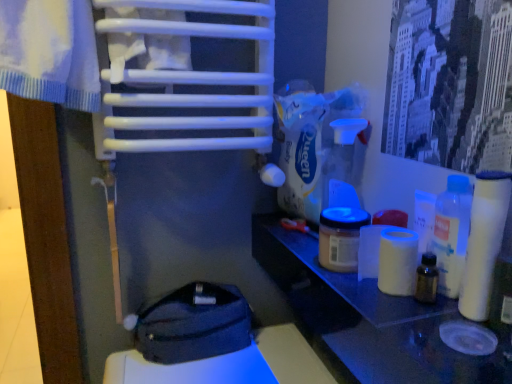
This screenshot has width=512, height=384. What do you see at coordinates (452, 233) in the screenshot? I see `translucent plastic bottle at right` at bounding box center [452, 233].

In the scene shown: Measure the distance between dark gray fabric pouch at lower center and camera.

The distance of dark gray fabric pouch at lower center from camera is 37.83 inches.

This screenshot has height=384, width=512. What do you see at coordinates (194, 324) in the screenshot?
I see `dark gray fabric pouch at lower center` at bounding box center [194, 324].

I want to click on white matte toilet paper at right, which appears as the 1th toilet paper when viewed from the left, so click(x=397, y=261).

Image resolution: width=512 pixels, height=384 pixels. Describe the element at coordinates (341, 237) in the screenshot. I see `matte plastic jar at center` at that location.

What do you see at coordinates (366, 319) in the screenshot?
I see `white glossy table at right` at bounding box center [366, 319].

I want to click on white matte toilet paper at right, which ranks as the 1th toilet paper in right-to-left order, so click(x=484, y=242).

Looking at this image, can you tell me how much dark gray fabric pouch at lower center and white matte toilet paper at right, marked as the second toilet paper in a front-to-back arrangement, differ in facing direction?

A: The angular difference between dark gray fabric pouch at lower center and white matte toilet paper at right, marked as the second toilet paper in a front-to-back arrangement, is 89.8 degrees.

Could white matte toilet paper at right, marked as the second toilet paper in a front-to-back arrangement, be considered to be inside dark gray fabric pouch at lower center?

No, white matte toilet paper at right, marked as the second toilet paper in a front-to-back arrangement, is not surrounded by dark gray fabric pouch at lower center.

Could you tell me if dark gray fabric pouch at lower center is facing white matte toilet paper at right, which appears as the 1th toilet paper when viewed from the left?

No.

Where is `pouch behind the white matte toilet paper at right, which appears as the 1th toilet paper when viewed from the left`? This screenshot has width=512, height=384. pouch behind the white matte toilet paper at right, which appears as the 1th toilet paper when viewed from the left is located at coordinates (194, 324).

Is white glossy table at right aimed at white matte toilet paper at right, which appears as the 1th toilet paper when viewed from the left?

No, white glossy table at right is not oriented towards white matte toilet paper at right, which appears as the 1th toilet paper when viewed from the left.

Is white glossy table at right beside white matte toilet paper at right, the first toilet paper viewed from the back?

No.

Based on the photo, does white glossy table at right have a smaller size compared to white matte toilet paper at right, which appears as the 1th toilet paper when viewed from the left?

No.

Is white matte toilet paper at right, which ranks as the 2th toilet paper in left-to-right order, in contact with dark gray fabric pouch at lower center?

white matte toilet paper at right, which ranks as the 2th toilet paper in left-to-right order, is not next to dark gray fabric pouch at lower center, and they're not touching.

Is white matte toilet paper at right, which ranks as the 1th toilet paper in right-to-left order, facing away from dark gray fabric pouch at lower center?

That's not correct — white matte toilet paper at right, which ranks as the 1th toilet paper in right-to-left order, is not looking away from dark gray fabric pouch at lower center.

From the image's perspective, who appears lower, dark gray fabric pouch at lower center or translucent plastic bottle at right?

dark gray fabric pouch at lower center is shown below in the image.

Considering the relative sizes of dark gray fabric pouch at lower center and translucent plastic bottle at right in the image provided, is dark gray fabric pouch at lower center thinner than translucent plastic bottle at right?

Incorrect, the width of dark gray fabric pouch at lower center is not less than that of translucent plastic bottle at right.

Is point (181, 303) positioned behind point (463, 227)?

Yes, point (181, 303) is farther from viewer.

From the image's perspective, is white matte toilet paper at right, which ranks as the 1th toilet paper in right-to-left order, positioned above or below white glossy table at right?

white matte toilet paper at right, which ranks as the 1th toilet paper in right-to-left order, is situated higher than white glossy table at right in the image.

Does white matte toilet paper at right, marked as the first toilet paper in a front-to-back arrangement, touch white glossy table at right?

There is a gap between white matte toilet paper at right, marked as the first toilet paper in a front-to-back arrangement, and white glossy table at right.

Can you tell me how much white matte toilet paper at right, which ranks as the 2th toilet paper in left-to-right order, and white glossy table at right differ in facing direction?

The facing directions of white matte toilet paper at right, which ranks as the 2th toilet paper in left-to-right order, and white glossy table at right are 17.5 degrees apart.

Between point (505, 180) and point (323, 304), which one is positioned behind?

The point (323, 304) is more distant.

Is translucent plastic bottle at right completely or partially inside white matte toilet paper at right, which ranks as the 1th toilet paper in right-to-left order?

No, white matte toilet paper at right, which ranks as the 1th toilet paper in right-to-left order, does not contain translucent plastic bottle at right.

There is a translucent plastic bottle at right. At what (x,y) coordinates should I click in order to perform the action: click on toilet paper above it (from a real-world perspective). Please return your answer as a coordinate pair (x, y). Image resolution: width=512 pixels, height=384 pixels. Looking at the image, I should click on (484, 242).

In the image, is white matte toilet paper at right, marked as the first toilet paper in a front-to-back arrangement, on the left side or the right side of translucent plastic bottle at right?

white matte toilet paper at right, marked as the first toilet paper in a front-to-back arrangement, is to the right of translucent plastic bottle at right.

Considering their positions, is white matte toilet paper at right, which ranks as the 2th toilet paper in left-to-right order, located in front of or behind translucent plastic bottle at right?

Clearly, white matte toilet paper at right, which ranks as the 2th toilet paper in left-to-right order, is in front of translucent plastic bottle at right.

The width and height of the screenshot is (512, 384). In order to click on toilet paper above the white matte toilet paper at right, which ranks as the 2th toilet paper in right-to-left order (from a real-world perspective) in this screenshot , I will do `click(484, 242)`.

Is white matte toilet paper at right, placed as the second toilet paper when sorted from back to front, facing away from white matte toilet paper at right, which ranks as the 2th toilet paper in right-to-left order?

No, white matte toilet paper at right, placed as the second toilet paper when sorted from back to front,'s orientation is not away from white matte toilet paper at right, which ranks as the 2th toilet paper in right-to-left order.

Which is in front, white matte toilet paper at right, placed as the second toilet paper when sorted from back to front, or white matte toilet paper at right, which ranks as the 2th toilet paper in right-to-left order?

white matte toilet paper at right, placed as the second toilet paper when sorted from back to front, is in front.

Find the location of a particular element. The image size is (512, 384). pouch on the left of white matte toilet paper at right, marked as the second toilet paper in a front-to-back arrangement is located at coordinates (194, 324).

At what (x,y) coordinates should I click in order to perform the action: click on toilet paper that is the 1st one above the white glossy table at right (from a real-world perspective). Please return your answer as a coordinate pair (x, y). Looking at the image, I should click on (397, 261).

Consider the image. Based on their spatial positions, is matte plastic jar at center or white matte toilet paper at right, placed as the second toilet paper when sorted from back to front, further from translucent plastic bottle at right?

matte plastic jar at center is further to translucent plastic bottle at right.

Estimate the real-world distances between objects in this image. Which object is closer to dark gray fabric pouch at lower center, matte plastic jar at center or white matte toilet paper at right, which ranks as the 2th toilet paper in left-to-right order?

matte plastic jar at center.

Looking at the image, which one is located further to dark gray fabric pouch at lower center, white glossy table at right or white matte toilet paper at right, which appears as the 1th toilet paper when viewed from the left?

The object further to dark gray fabric pouch at lower center is white matte toilet paper at right, which appears as the 1th toilet paper when viewed from the left.

Looking at the image, which one is located further to translucent plastic bottle at right, white matte toilet paper at right, marked as the first toilet paper in a front-to-back arrangement, or dark gray fabric pouch at lower center?

dark gray fabric pouch at lower center.

Estimate the real-world distances between objects in this image. Which object is further from white matte toilet paper at right, which ranks as the 2th toilet paper in right-to-left order, white glossy table at right or white matte toilet paper at right, placed as the second toilet paper when sorted from back to front?

white glossy table at right is further to white matte toilet paper at right, which ranks as the 2th toilet paper in right-to-left order.

Looking at the image, which one is located closer to white matte toilet paper at right, which ranks as the 2th toilet paper in left-to-right order, dark gray fabric pouch at lower center or matte plastic jar at center?

matte plastic jar at center is closer to white matte toilet paper at right, which ranks as the 2th toilet paper in left-to-right order.

Which object lies nearer to the anchor point dark gray fabric pouch at lower center, translucent plastic bottle at right or white matte toilet paper at right, marked as the first toilet paper in a front-to-back arrangement?

translucent plastic bottle at right is closer to dark gray fabric pouch at lower center.

From the image, which object appears to be farther from translucent plastic bottle at right, dark gray fabric pouch at lower center or white glossy table at right?

Among the two, dark gray fabric pouch at lower center is located further to translucent plastic bottle at right.

This screenshot has height=384, width=512. I want to click on product between dark gray fabric pouch at lower center and translucent plastic bottle at right from left to right, so click(341, 237).

You are a GUI agent. You are given a task and a screenshot of the screen. Output one action in this format:
    pyautogui.click(x=<x>, y=<y>)
    Task: Click on the toilet paper positioned between white glossy table at right and white matte toilet paper at right, which ranks as the 2th toilet paper in right-to-left order, from near to far
    
    Given the screenshot: What is the action you would take?
    pyautogui.click(x=484, y=242)

Locate an element on the screen. This screenshot has width=512, height=384. table between dark gray fabric pouch at lower center and white matte toilet paper at right, marked as the first toilet paper in a front-to-back arrangement, from left to right is located at coordinates (366, 319).

At what (x,y) coordinates should I click in order to perform the action: click on table between dark gray fabric pouch at lower center and translucent plastic bottle at right from left to right. Please return your answer as a coordinate pair (x, y). The image size is (512, 384). Looking at the image, I should click on click(x=366, y=319).